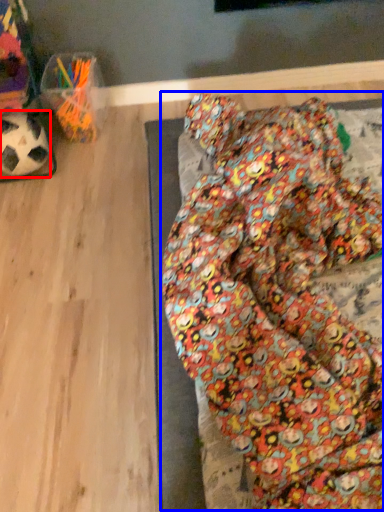
Question: Which of the following is the closest to the observer, football (highlighted by a red box) or bean bag chair (highlighted by a blue box)?

Choices:
 (A) football
 (B) bean bag chair

Answer: (B)